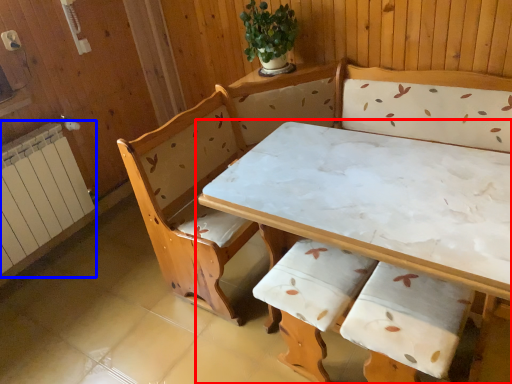
Question: Among these objects, which one is nearest to the camera, table (highlighted by a red box) or radiator (highlighted by a blue box)?

Choices:
 (A) table
 (B) radiator

Answer: (A)